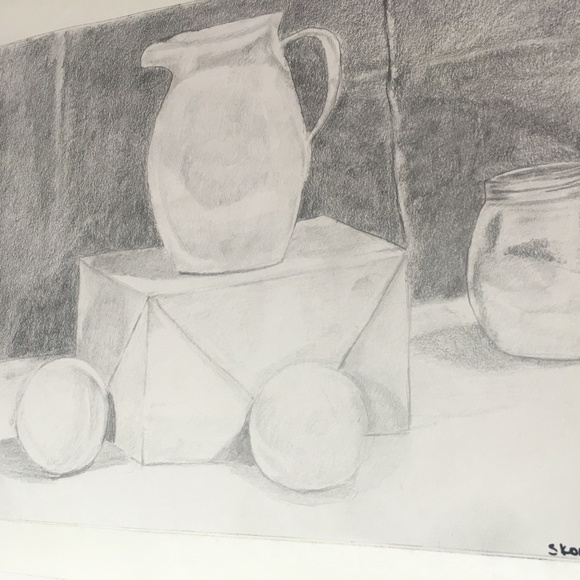
Locate an element on the screen. This screenshot has height=580, width=580. handle is located at coordinates (331, 50).